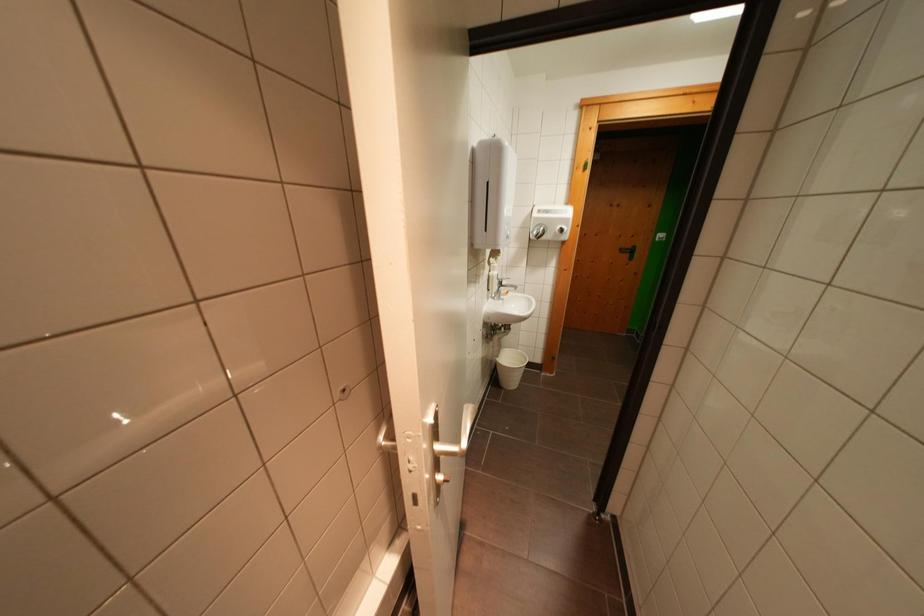
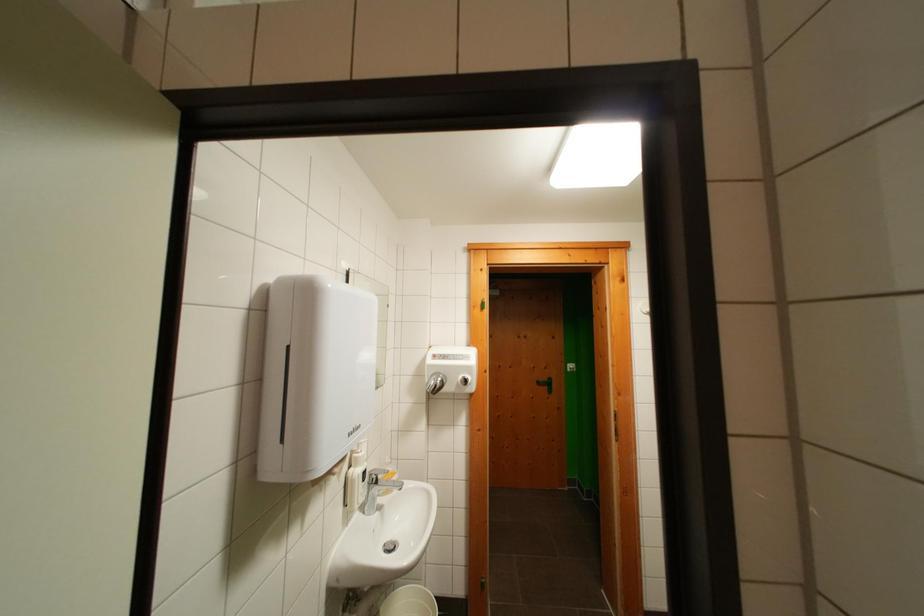
Locate, in the second image, the point that corresponds to (x=627, y=254) in the first image.

(544, 387)